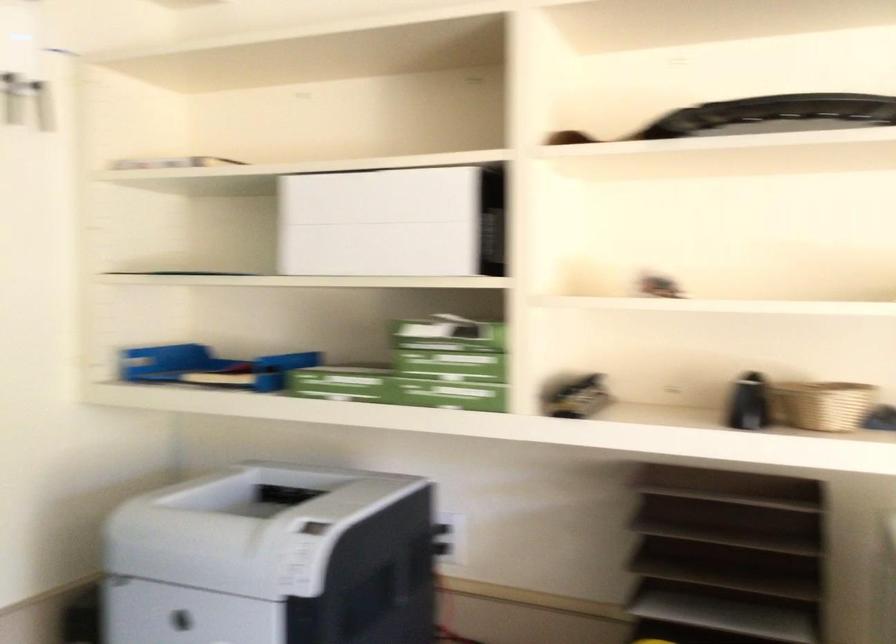
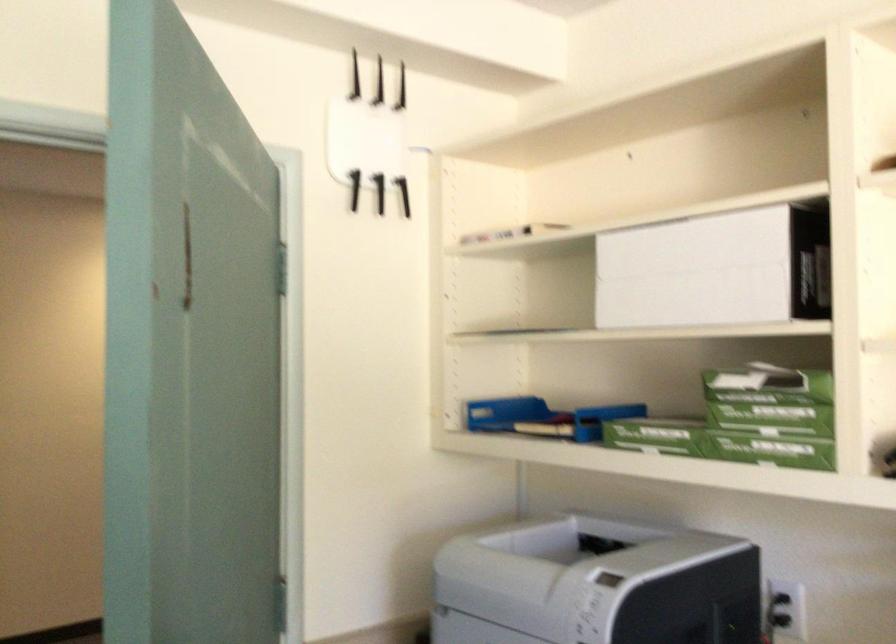
In the second image, find the point that corresponds to (x=342, y=379) in the first image.

(655, 435)